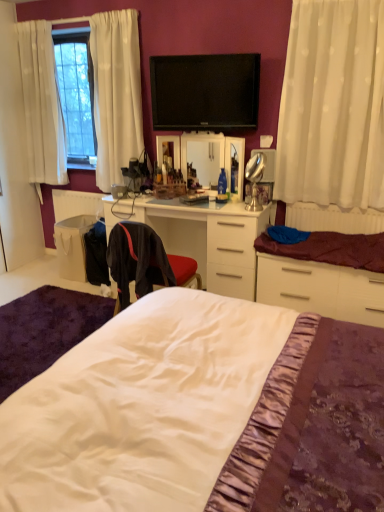
Question: Can you confirm if black fabric chair at center is smaller than white plastic radiator at right?

Choices:
 (A) no
 (B) yes

Answer: (A)

Question: From the image's perspective, does black fabric chair at center appear higher than white plastic radiator at right?

Choices:
 (A) no
 (B) yes

Answer: (A)

Question: Is there a large distance between black fabric chair at center and white plastic radiator at right?

Choices:
 (A) no
 (B) yes

Answer: (B)

Question: Does black fabric chair at center lie in front of white plastic radiator at right?

Choices:
 (A) yes
 (B) no

Answer: (A)

Question: Considering the relative sizes of black fabric chair at center and white plastic radiator at right in the image provided, is black fabric chair at center thinner than white plastic radiator at right?

Choices:
 (A) yes
 (B) no

Answer: (B)

Question: Is white sheer curtain at right taller or shorter than white fabric bag at lower left?

Choices:
 (A) tall
 (B) short

Answer: (A)

Question: Would you say white sheer curtain at right is to the left or to the right of white fabric bag at lower left in the picture?

Choices:
 (A) right
 (B) left

Answer: (A)

Question: Is white sheer curtain at right inside the boundaries of white fabric bag at lower left, or outside?

Choices:
 (A) inside
 (B) outside

Answer: (B)

Question: In the image, is white sheer curtain at right positioned in front of or behind white fabric bag at lower left?

Choices:
 (A) front
 (B) behind

Answer: (A)

Question: From a real-world perspective, is white plastic radiator at right physically located above or below black fabric chair at center?

Choices:
 (A) above
 (B) below

Answer: (A)

Question: Considering the positions of white plastic radiator at right and black fabric chair at center in the image, is white plastic radiator at right wider or thinner than black fabric chair at center?

Choices:
 (A) thin
 (B) wide

Answer: (A)

Question: Is white plastic radiator at right taller or shorter than black fabric chair at center?

Choices:
 (A) tall
 (B) short

Answer: (B)

Question: Is point (296, 214) closer or farther from the camera than point (142, 227)?

Choices:
 (A) farther
 (B) closer

Answer: (A)

Question: From the image's perspective, relative to white fabric bag at lower left, is white plastic radiator at right above or below?

Choices:
 (A) below
 (B) above

Answer: (B)

Question: In the image, is white plastic radiator at right on the left side or the right side of white fabric bag at lower left?

Choices:
 (A) right
 (B) left

Answer: (A)